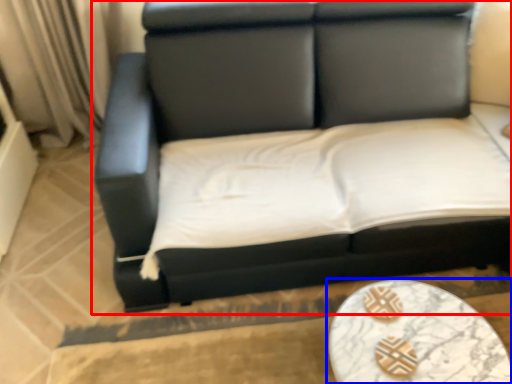
Question: Which object appears farthest to the camera in this image, studio couch (highlighted by a red box) or table (highlighted by a blue box)?

Choices:
 (A) studio couch
 (B) table

Answer: (B)